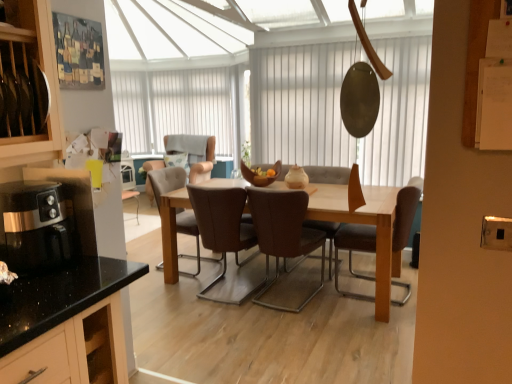
Image resolution: width=512 pixels, height=384 pixels. Identify the location of vacant area situated below brown leather chair at center, marked as the 3th chair in a front-to-back arrangement (from a real-world perspective). (236, 286).